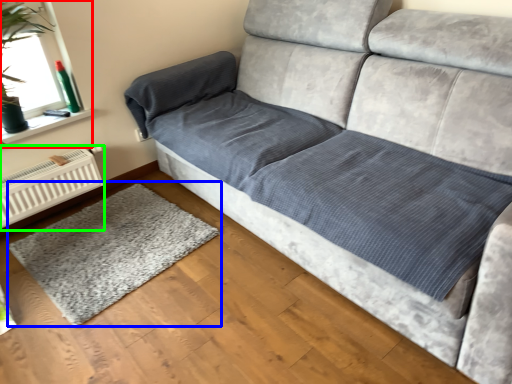
Question: Which object is the closest to the window screen (highlighted by a red box)? Choose among these: mat (highlighted by a blue box) or radiator (highlighted by a green box).

Choices:
 (A) mat
 (B) radiator

Answer: (B)